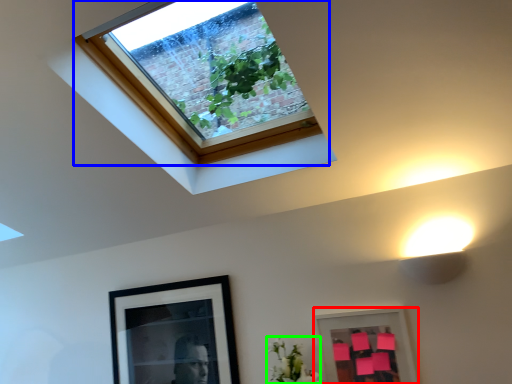
Question: Which object is positioned farthest from picture frame (highlighted by a red box)? Select from window (highlighted by a blue box) and flower (highlighted by a green box).

Choices:
 (A) window
 (B) flower

Answer: (A)